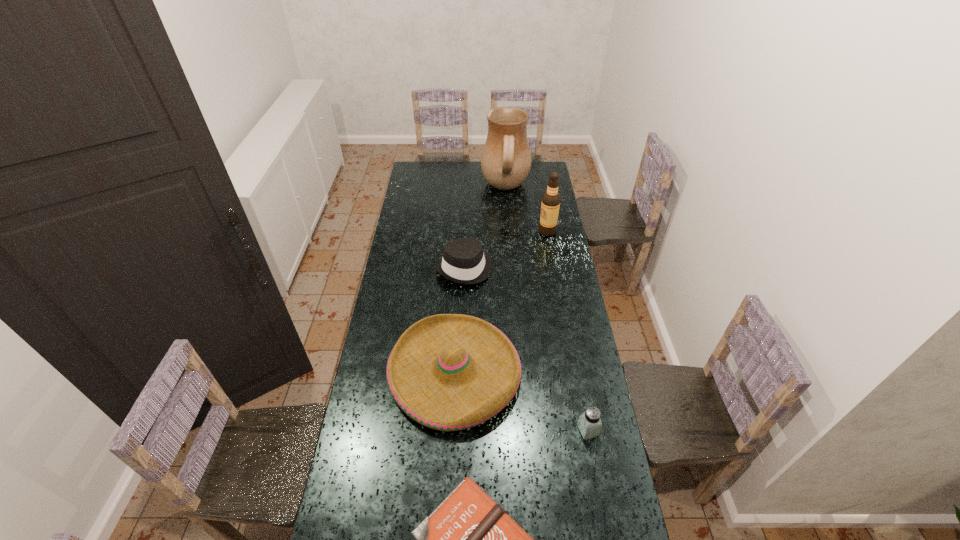
Where is `vacant space situated 0.400m on the label of the second tallest object`? This screenshot has width=960, height=540. vacant space situated 0.400m on the label of the second tallest object is located at coordinates (462, 232).

You are a GUI agent. You are given a task and a screenshot of the screen. Output one action in this format:
    pyautogui.click(x=<x>, y=<y>)
    Task: Click on the vacant area situated 0.100m on the label of the second tallest object
    The image size is (960, 540).
    Given the screenshot: What is the action you would take?
    pyautogui.click(x=519, y=232)

At what (x,y) coordinates should I click in order to perform the action: click on blank space located 0.360m on the label of the second tallest object. Please return your answer as a coordinate pair (x, y). The image size is (960, 540). Looking at the image, I should click on (469, 232).

Locate an element on the screen. This screenshot has height=540, width=960. free location located 0.240m on the back of the fedora is located at coordinates pyautogui.click(x=467, y=221).

I want to click on vacant space positioned on the back of the sombrero, so click(459, 284).

The image size is (960, 540). I want to click on free spot located 0.240m on the left of the saltshaker, so click(x=509, y=430).

Where is `object present at the far edge`? This screenshot has height=540, width=960. object present at the far edge is located at coordinates (506, 159).

Where is `object that is at the left edge`? Image resolution: width=960 pixels, height=540 pixels. object that is at the left edge is located at coordinates (449, 372).

Locate an element on the screen. The height and width of the screenshot is (540, 960). cream pitcher located at the right edge is located at coordinates (506, 159).

Identify the location of alcohol located at the right edge. Image resolution: width=960 pixels, height=540 pixels. (550, 204).